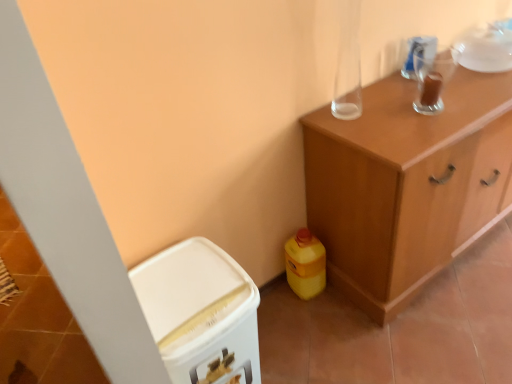
In order to click on yellow plastic bottle at lower right in this screenshot , I will do `click(305, 264)`.

I want to click on wooden cabinet at upper right, which is the first cabinetry from right to left, so click(x=406, y=184).

Is white plastic bin at lower left, positioned as the first cabinetry in left-to-right order, next to transparent glass cup at upper right and touching it?

No, white plastic bin at lower left, positioned as the first cabinetry in left-to-right order, is not beside transparent glass cup at upper right.

Based on the photo, between white plastic bin at lower left, which appears as the second cabinetry when viewed from the right, and transparent glass cup at upper right, which one has smaller size?

With smaller size is transparent glass cup at upper right.

Is white plastic bin at lower left, positioned as the first cabinetry in left-to-right order, to the left of transparent glass cup at upper right from the viewer's perspective?

Yes.

Find the location of a particular element. Image resolution: width=512 pixels, height=384 pixels. appliance behind the white plastic bin at lower left, which appears as the second cabinetry when viewed from the right is located at coordinates (432, 77).

Between transparent glass cup at upper right and yellow plastic bottle at lower right, which one has larger width?

With larger width is yellow plastic bottle at lower right.

Does point (417, 102) lie in front of point (285, 259)?

Yes.

How many degrees apart are the facing directions of transparent glass cup at upper right and yellow plastic bottle at lower right?

The angle between the facing direction of transparent glass cup at upper right and the facing direction of yellow plastic bottle at lower right is 0.000793 degrees.

Are yellow plastic bottle at lower right and white plastic bin at lower left, which appears as the second cabinetry when viewed from the right, making contact?

There is a gap between yellow plastic bottle at lower right and white plastic bin at lower left, which appears as the second cabinetry when viewed from the right.

The width and height of the screenshot is (512, 384). I want to click on cabinetry that is the 2nd object located in front of the yellow plastic bottle at lower right, so tap(201, 313).

From the picture: From the image's perspective, is yellow plastic bottle at lower right over white plastic bin at lower left, which appears as the second cabinetry when viewed from the right?

Yes, from the image's perspective, yellow plastic bottle at lower right is on top of white plastic bin at lower left, which appears as the second cabinetry when viewed from the right.

Does white plastic bin at lower left, which appears as the second cabinetry when viewed from the right, have a smaller size compared to yellow plastic bottle at lower right?

No.

From a real-world perspective, which object stands above the other?

white plastic bin at lower left, positioned as the first cabinetry in left-to-right order.

How different are the orientations of white plastic bin at lower left, positioned as the first cabinetry in left-to-right order, and yellow plastic bottle at lower right in degrees?

They differ by 1.4 degrees in their facing directions.

Is wooden cabinet at upper right, which is the first cabinetry from right to left, located outside white plastic bin at lower left, which appears as the second cabinetry when viewed from the right?

Yes, wooden cabinet at upper right, which is the first cabinetry from right to left, is not within white plastic bin at lower left, which appears as the second cabinetry when viewed from the right.

From the image's perspective, which is below, wooden cabinet at upper right, which is the first cabinetry from right to left, or white plastic bin at lower left, positioned as the first cabinetry in left-to-right order?

white plastic bin at lower left, positioned as the first cabinetry in left-to-right order, is shown below in the image.

Considering the points (399, 298) and (223, 383), which point is behind, point (399, 298) or point (223, 383)?

The point (399, 298) is more distant.

Is yellow plastic bottle at lower right with transparent glass cup at upper right?

yellow plastic bottle at lower right is not next to transparent glass cup at upper right, and they're not touching.

From the image's perspective, which one is positioned higher, yellow plastic bottle at lower right or transparent glass cup at upper right?

From the image's view, transparent glass cup at upper right is above.

Which is in front, yellow plastic bottle at lower right or transparent glass cup at upper right?

transparent glass cup at upper right is more forward.

Is point (316, 269) positioned behind point (432, 77)?

Yes, it is behind point (432, 77).

At what (x,y) coordinates should I click in order to perform the action: click on the 1st cabinetry in front of the yellow plastic bottle at lower right. Please return your answer as a coordinate pair (x, y). Looking at the image, I should click on (406, 184).

Can you confirm if yellow plastic bottle at lower right is thinner than wooden cabinet at upper right, which is the first cabinetry from right to left?

Correct, the width of yellow plastic bottle at lower right is less than that of wooden cabinet at upper right, which is the first cabinetry from right to left.

Is yellow plastic bottle at lower right facing towards wooden cabinet at upper right, which is the first cabinetry from right to left?

No, yellow plastic bottle at lower right does not turn towards wooden cabinet at upper right, which is the first cabinetry from right to left.

From the image's perspective, would you say yellow plastic bottle at lower right is positioned over wooden cabinet at upper right, which is the first cabinetry from right to left?

No, from the image's perspective, yellow plastic bottle at lower right is not on top of wooden cabinet at upper right, which is the first cabinetry from right to left.

Find the location of a particular element. appliance behind the white plastic bin at lower left, which appears as the second cabinetry when viewed from the right is located at coordinates (432, 77).

The width and height of the screenshot is (512, 384). I want to click on appliance above the yellow plastic bottle at lower right (from the image's perspective), so click(432, 77).

From the image, which object appears to be farther from transparent glass cup at upper right, yellow plastic bottle at lower right or wooden cabinet at upper right, which is the first cabinetry from right to left?

Based on the image, yellow plastic bottle at lower right appears to be further to transparent glass cup at upper right.

From the image, which object appears to be farther from yellow plastic bottle at lower right, white plastic bin at lower left, which appears as the second cabinetry when viewed from the right, or transparent glass cup at upper right?

transparent glass cup at upper right is further to yellow plastic bottle at lower right.

From the image, which object appears to be farther from wooden cabinet at upper right, which is the first cabinetry from right to left, yellow plastic bottle at lower right or white plastic bin at lower left, positioned as the first cabinetry in left-to-right order?

white plastic bin at lower left, positioned as the first cabinetry in left-to-right order, is further to wooden cabinet at upper right, which is the first cabinetry from right to left.

Considering their positions, is transparent glass cup at upper right positioned closer to white plastic bin at lower left, which appears as the second cabinetry when viewed from the right, than wooden cabinet at upper right, which is the first cabinetry from right to left?

wooden cabinet at upper right, which is the first cabinetry from right to left.

Based on their spatial positions, is wooden cabinet at upper right, arranged as the 2th cabinetry when viewed from the left, or transparent glass cup at upper right further from white plastic bin at lower left, which appears as the second cabinetry when viewed from the right?

The object further to white plastic bin at lower left, which appears as the second cabinetry when viewed from the right, is transparent glass cup at upper right.

From the image, which object appears to be nearer to white plastic bin at lower left, positioned as the first cabinetry in left-to-right order, yellow plastic bottle at lower right or wooden cabinet at upper right, arranged as the 2th cabinetry when viewed from the left?

yellow plastic bottle at lower right lies closer to white plastic bin at lower left, positioned as the first cabinetry in left-to-right order, than the other object.

Considering their positions, is transparent glass cup at upper right positioned closer to white plastic bin at lower left, positioned as the first cabinetry in left-to-right order, than yellow plastic bottle at lower right?

Among the two, yellow plastic bottle at lower right is located nearer to white plastic bin at lower left, positioned as the first cabinetry in left-to-right order.

Looking at the image, which one is located further to yellow plastic bottle at lower right, wooden cabinet at upper right, arranged as the 2th cabinetry when viewed from the left, or white plastic bin at lower left, which appears as the second cabinetry when viewed from the right?

Based on the image, white plastic bin at lower left, which appears as the second cabinetry when viewed from the right, appears to be further to yellow plastic bottle at lower right.

The height and width of the screenshot is (384, 512). Identify the location of appliance located between white plastic bin at lower left, which appears as the second cabinetry when viewed from the right, and wooden cabinet at upper right, which is the first cabinetry from right to left, in the left-right direction. (432, 77).

Where is `cleaning product between white plastic bin at lower left, which appears as the second cabinetry when viewed from the right, and wooden cabinet at upper right, which is the first cabinetry from right to left, in the horizontal direction`? The image size is (512, 384). cleaning product between white plastic bin at lower left, which appears as the second cabinetry when viewed from the right, and wooden cabinet at upper right, which is the first cabinetry from right to left, in the horizontal direction is located at coordinates (305, 264).

The height and width of the screenshot is (384, 512). What are the coordinates of `appliance between yellow plastic bottle at lower right and wooden cabinet at upper right, which is the first cabinetry from right to left` in the screenshot? It's located at (432, 77).

Identify the location of cleaning product that lies between transparent glass cup at upper right and white plastic bin at lower left, which appears as the second cabinetry when viewed from the right, from top to bottom. (305, 264).